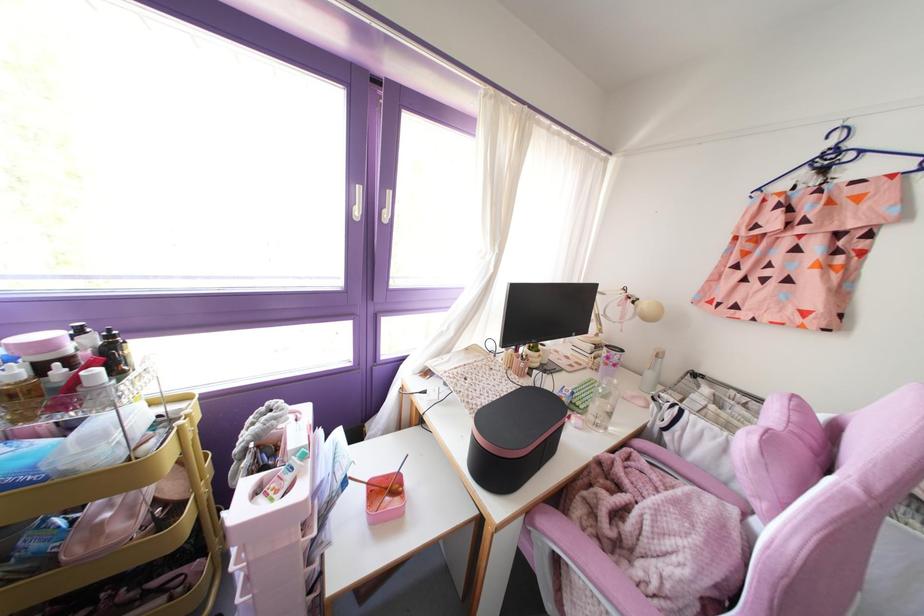
Where would you turn the white window handle? Please return your answer as a coordinate pair (x, y).

(358, 203)